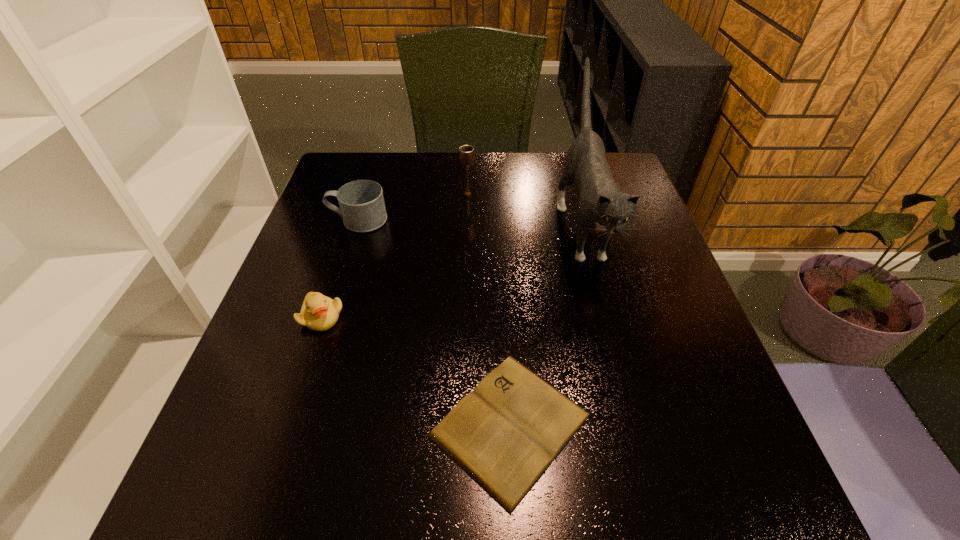
Locate an element on the screen. The width and height of the screenshot is (960, 540). the rightmost object is located at coordinates (602, 207).

Locate an element on the screen. This screenshot has width=960, height=540. cat is located at coordinates (602, 207).

Locate an element on the screen. chalice is located at coordinates (466, 152).

Identify the location of mug. (362, 208).

Locate an element on the screen. This screenshot has width=960, height=540. the second shortest object is located at coordinates (318, 312).

Where is `duckling`? This screenshot has width=960, height=540. duckling is located at coordinates (318, 312).

Locate an element on the screen. Image resolution: width=960 pixels, height=540 pixels. book is located at coordinates (504, 434).

What are the coordinates of `the nearest object` in the screenshot? It's located at (504, 434).

Find the location of a particular element. free space located 0.280m at the face of the rightmost object is located at coordinates [x=633, y=418].

You are a GUI agent. You are given a task and a screenshot of the screen. Output one action in this format:
    pyautogui.click(x=<x>, y=<y>)
    Task: Click on the free space located on the left of the chalice
    The image size is (960, 540).
    Given the screenshot: What is the action you would take?
    pyautogui.click(x=357, y=194)